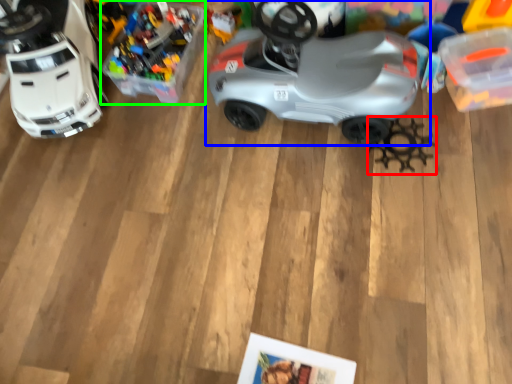
Question: Considering the real-world distances, which object is farthest from toy (highlighted by a red box)? car (highlighted by a blue box) or toy (highlighted by a green box)?

Choices:
 (A) car
 (B) toy

Answer: (B)